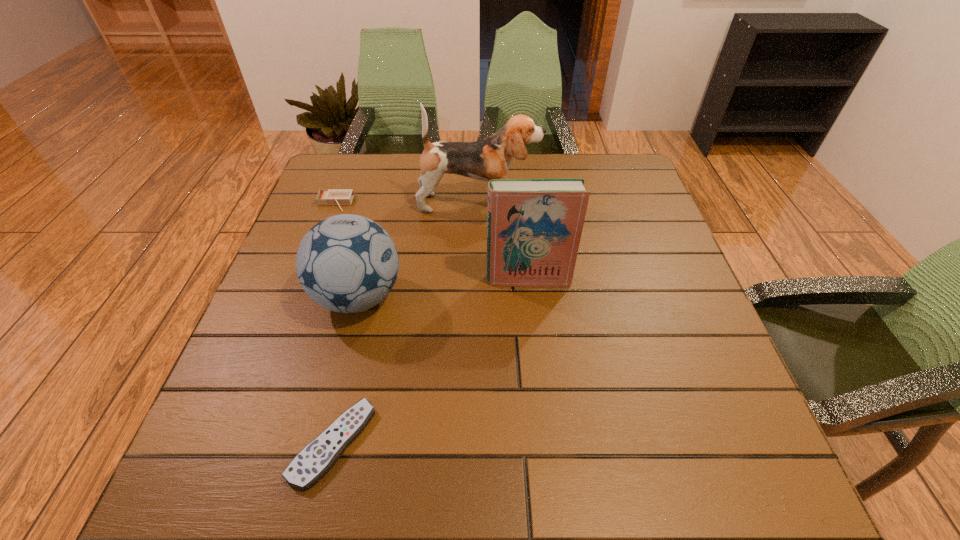
You are a GUI agent. You are given a task and a screenshot of the screen. Output one action in this format:
    pyautogui.click(x=<x>, y=<y>)
    Task: Click on the puppy
    This screenshot has height=540, width=960.
    Given the screenshot: What is the action you would take?
    pyautogui.click(x=490, y=158)

I want to click on hardback book, so click(x=534, y=226).

Identify the location of the third shortest object. (346, 263).

Find the location of `matchbox`. matchbox is located at coordinates (339, 197).

Identify the location of the shortest object. The image size is (960, 540). (316, 458).

This screenshot has height=540, width=960. I want to click on remote control, so click(316, 458).

Identify the location of vacant space located at the face of the puppy. This screenshot has height=540, width=960. (581, 203).

This screenshot has height=540, width=960. Identify the location of vacant space situated on the cover of the hardback book. point(544,437).

At what (x,y) coordinates should I click in order to perform the action: click on vacant space located on the side with brand of the soccer ball. Please return your answer as a coordinate pair (x, y). The height and width of the screenshot is (540, 960). Looking at the image, I should click on (584, 297).

This screenshot has height=540, width=960. Find the location of `vacant region located 0.130m on the striking surface of the matchbox`. vacant region located 0.130m on the striking surface of the matchbox is located at coordinates (320, 244).